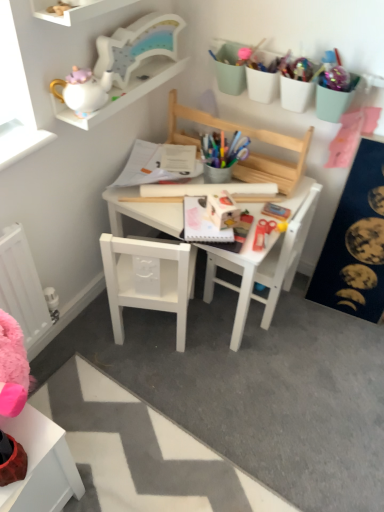
Locate an element on the screen. The image size is (384, 512). free spot in front of dark blue fabric bulletin board at right is located at coordinates (342, 347).